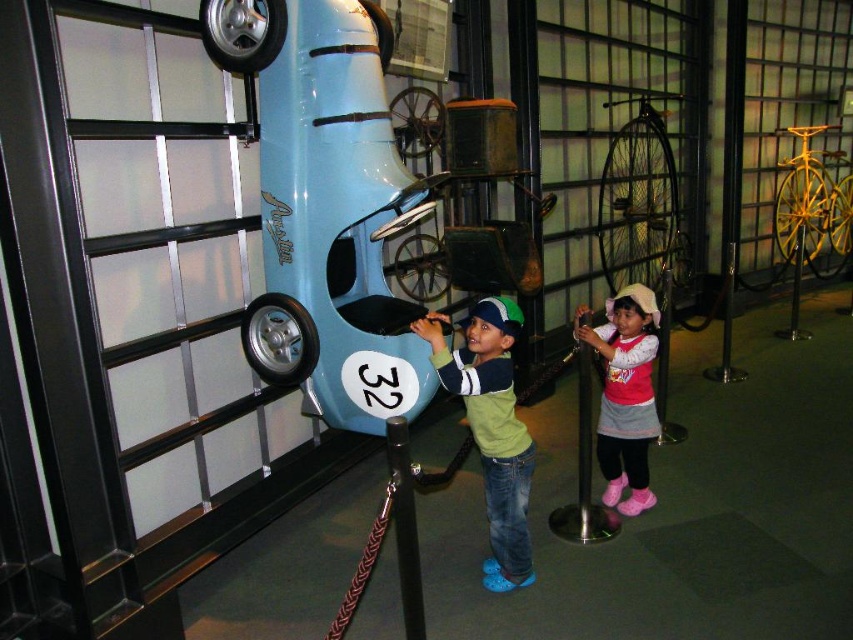
You are a visitor at the museum and want to touch the vintage Austin car. However, there is an obstruction at point (491,428). What is blocking your path to the car?

The green matte shirt at center is blocking your path to the car at point (491,428).

You are a fashion designer observing the exhibition and notice the green matte shirt at center and the pink fabric dress at lower right. Which clothing item has a greater width?

The green matte shirt at center has a greater width than the pink fabric dress at lower right.